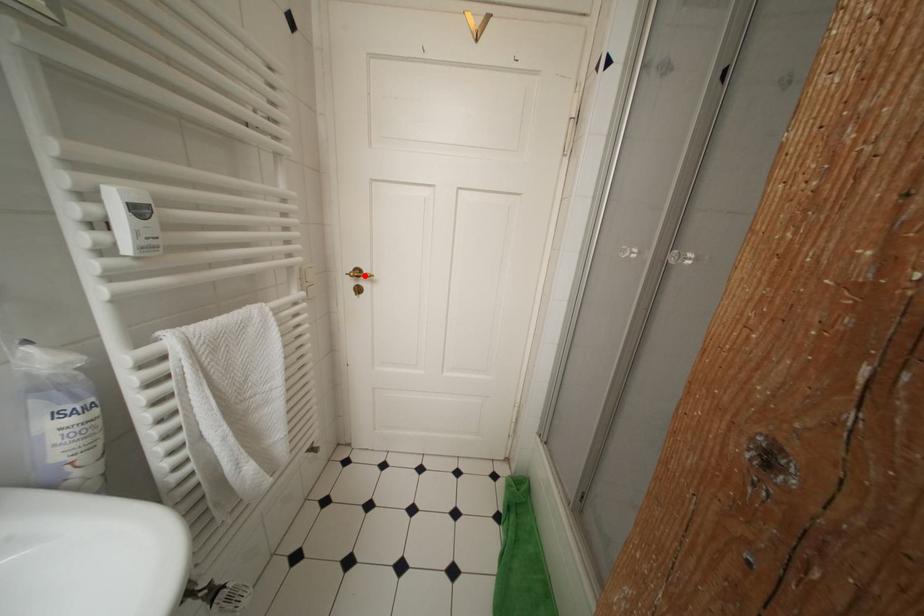
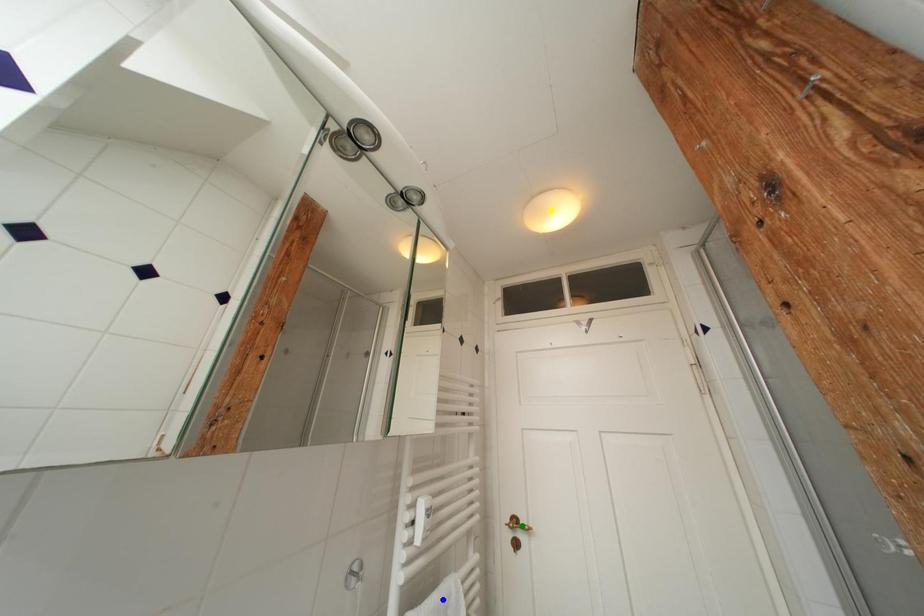
Question: I am providing you with two images of the same scene from different viewpoints. A red point is marked on the first image. You are given multiple points on the second image. Which spot in image 2 lines up with the point in image 1?

Choices:
 (A) yellow point
 (B) green point
 (C) blue point

Answer: (B)